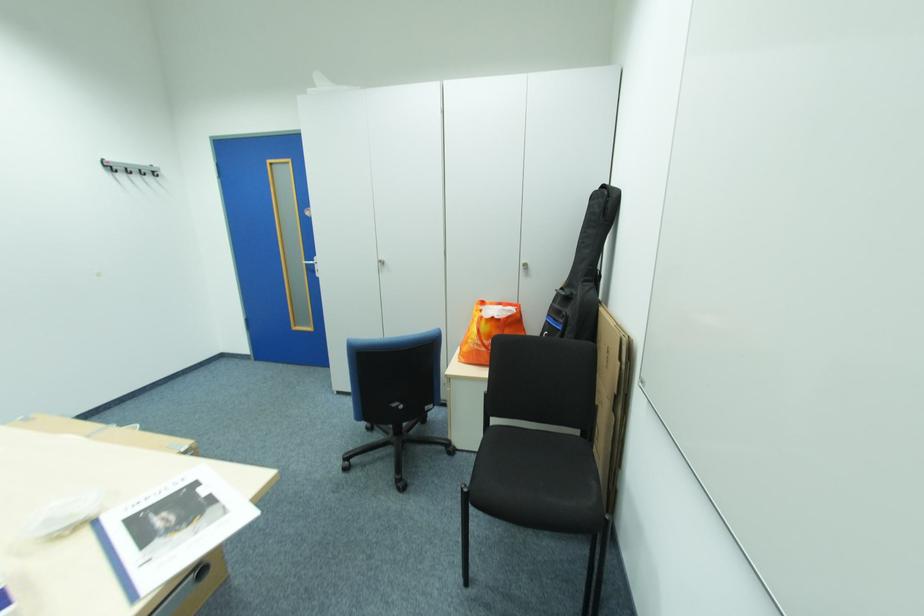
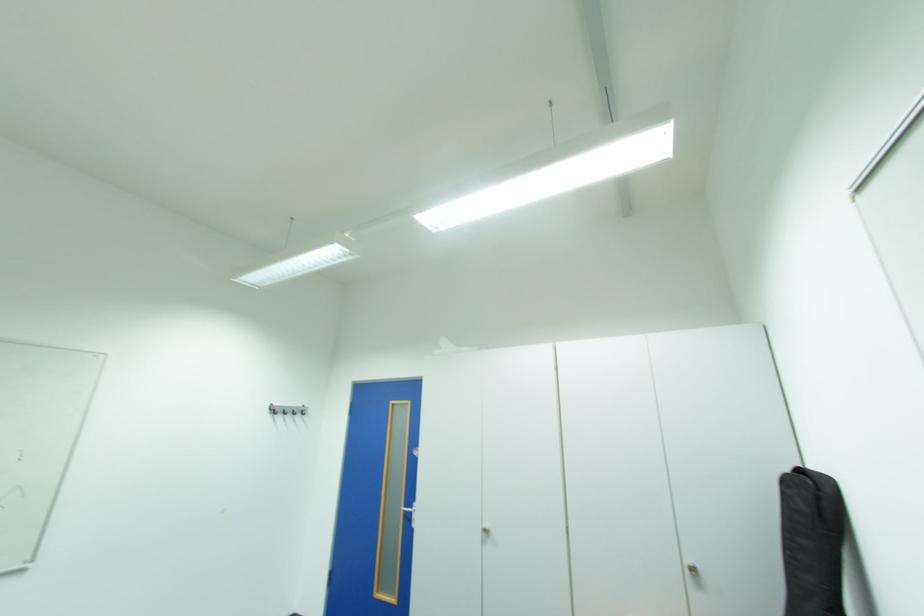
The point at (114,171) is marked in the first image. Where is the corresponding point in the second image?

(280, 411)